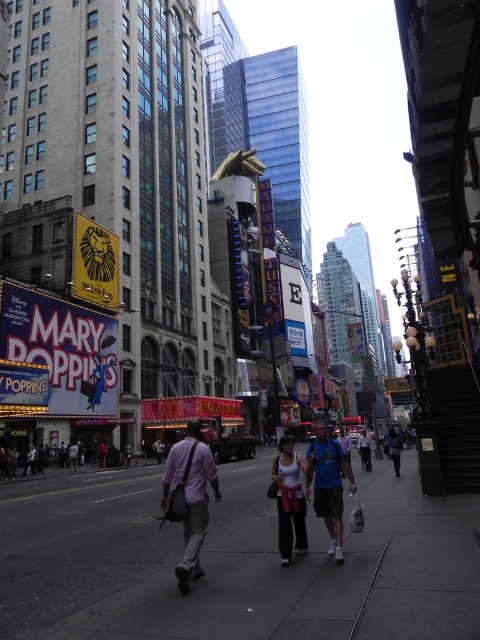
You are a fashion designer observing the scene. You notice the matte pink tank top at center and the blue fabric backpack at center. Which item is taller?

The matte pink tank top at center has a greater height compared to the blue fabric backpack at center, so the matte pink tank top at center is taller.

You are a photographer standing at the center of the street. You want to take a photo of both the concrete sidewalk at center and the matte pink tank top at center. Which object will occupy more space in your photo?

The concrete sidewalk at center is bigger than the matte pink tank top at center, so it will occupy more space in the photo.

You are standing at the entrance of the street and want to walk to the concrete sidewalk at center. According to the scene description, in which direction should you move relative to your current position?

The concrete sidewalk at center is located at point (x=239, y=564), so you should move forward and slightly to the right to reach it.